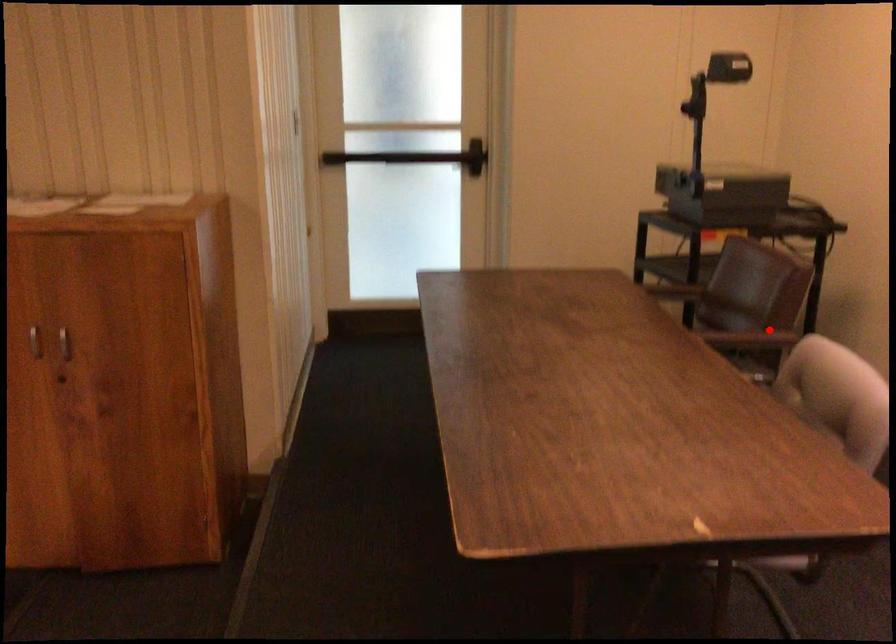
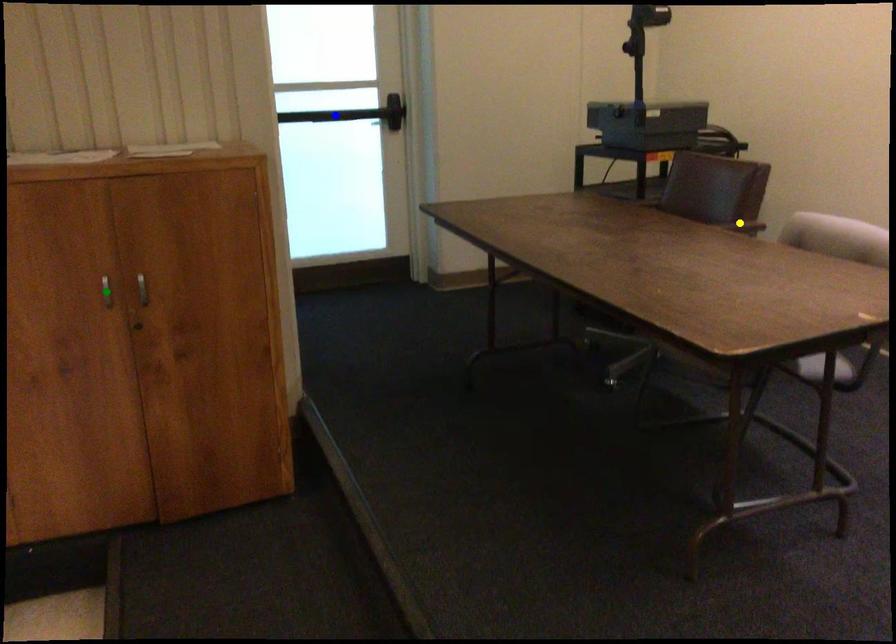
Question: I am providing you with two images of the same scene from different viewpoints. A red point is marked on the first image. You are given multiple points on the second image. Which spot in image 2 lines up with the point in image 1?

Choices:
 (A) blue point
 (B) yellow point
 (C) green point

Answer: (B)